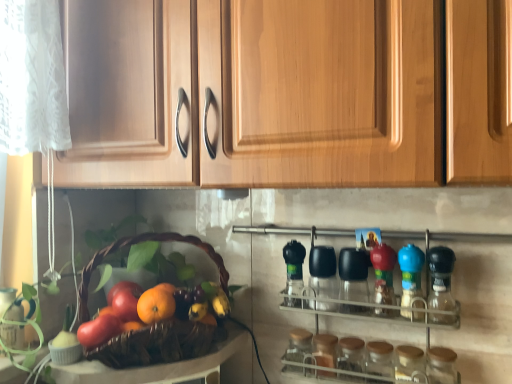
Identify the location of transparent plastic spice rack at center. (443, 239).

The width and height of the screenshot is (512, 384). Describe the element at coordinates (443, 239) in the screenshot. I see `transparent plastic spice rack at center` at that location.

You are a GUI agent. You are given a task and a screenshot of the screen. Output one action in this format:
    pyautogui.click(x=<x>, y=<y>)
    Task: Click on the brown woven basket at lower left
    This screenshot has height=384, width=512.
    Given the screenshot: What is the action you would take?
    click(155, 345)

What is the approximate width of orange matte at center?

orange matte at center is 2.50 inches wide.

What is the approximate height of orange matte at center?

The height of orange matte at center is 5.90 centimeters.

You are a GUI agent. You are given a task and a screenshot of the screen. Output one action in this format:
    pyautogui.click(x=<x>, y=<y>)
    Task: Click on the matte red apple at lower left, placed as the 1th apple when sorted from front to back
    Image resolution: width=512 pixels, height=384 pixels.
    Given the screenshot: What is the action you would take?
    pyautogui.click(x=99, y=330)

The image size is (512, 384). Describe the element at coordinates (294, 266) in the screenshot. I see `green matte bottle at center, marked as the fourth bottle in a right-to-left arrangement` at that location.

Locate an element on the screen. This screenshot has width=512, height=384. transparent plastic spice rack at center is located at coordinates (443, 239).

Would you consider transparent glass jar at lower right, which is the 1th bottle from right to left, to be distant from transparent plastic spice rack at center?

That's not correct — transparent glass jar at lower right, which is the 1th bottle from right to left, is a little close to transparent plastic spice rack at center.

Is transparent glass jar at lower right, which is the 1th bottle from right to left, turned away from transparent plastic spice rack at center?

Yes, transparent glass jar at lower right, which is the 1th bottle from right to left, is facing away from transparent plastic spice rack at center.

Consider the image. Which is more to the right, transparent glass jar at lower right, which is the fourth bottle in left-to-right order, or transparent plastic spice rack at center?

From the viewer's perspective, transparent glass jar at lower right, which is the fourth bottle in left-to-right order, appears more on the right side.

Looking at the image, does transparent glass jar at lower right, which is the fourth bottle in left-to-right order, seem bigger or smaller compared to transparent plastic spice rack at center?

Considering their sizes, transparent glass jar at lower right, which is the fourth bottle in left-to-right order, takes up less space than transparent plastic spice rack at center.

Could you tell me if transparent glass jar at lower center, the second bottle positioned from the left, is turned towards orange matte at center?

No, transparent glass jar at lower center, the second bottle positioned from the left, is not facing towards orange matte at center.

Considering the relative sizes of transparent glass jar at lower center, positioned as the 3th bottle in right-to-left order, and orange matte at center in the image provided, is transparent glass jar at lower center, positioned as the 3th bottle in right-to-left order, shorter than orange matte at center?

In fact, transparent glass jar at lower center, positioned as the 3th bottle in right-to-left order, may be taller than orange matte at center.

From a real-world perspective, is transparent glass jar at lower center, positioned as the 3th bottle in right-to-left order, positioned under orange matte at center based on gravity?

Yes.

Consider the image. Who is smaller, transparent glass jar at lower center, the second bottle positioned from the left, or orange matte at center?

With smaller size is orange matte at center.

Considering the relative sizes of brown woven basket at lower left and transparent plastic spice rack at center in the image provided, is brown woven basket at lower left smaller than transparent plastic spice rack at center?

Actually, brown woven basket at lower left might be larger than transparent plastic spice rack at center.

From the image's perspective, is brown woven basket at lower left above transparent plastic spice rack at center?

Yes, from the image's perspective, brown woven basket at lower left is on top of transparent plastic spice rack at center.

Which is more to the left, brown woven basket at lower left or transparent plastic spice rack at center?

brown woven basket at lower left is more to the left.

In the scene shown: Between brown woven basket at lower left and transparent plastic spice rack at center, which one has smaller width?

transparent plastic spice rack at center is thinner.

Can you confirm if transparent glass jar at lower center, the second bottle positioned from the left, is taller than shiny purple grapes at center?

Indeed, transparent glass jar at lower center, the second bottle positioned from the left, has a greater height compared to shiny purple grapes at center.

Which is less distant, (341,360) or (177,296)?

Point (341,360) appears to be closer to the viewer than point (177,296).

Is transparent glass jar at lower center, positioned as the 3th bottle in right-to-left order, completely or partially outside of shiny purple grapes at center?

Yes.

Based on their positions, is transparent glass jar at lower center, positioned as the 3th bottle in right-to-left order, located to the left or right of shiny purple grapes at center?

Based on their positions, transparent glass jar at lower center, positioned as the 3th bottle in right-to-left order, is located to the right of shiny purple grapes at center.

Locate an element on the screen. orange above the matte red apple at lower left, the 2th apple positioned from the back (from the image's perspective) is located at coordinates (155, 305).

In the scene shown: Who is shorter, matte red apple at lower left, the 2th apple positioned from the back, or orange matte at center?

With less height is orange matte at center.

Is matte red apple at lower left, placed as the 1th apple when sorted from front to back, inside the boundaries of orange matte at center, or outside?

matte red apple at lower left, placed as the 1th apple when sorted from front to back, is not enclosed by orange matte at center.

In the scene shown: From a real-world perspective, which is physically below, matte red apple at lower left, the 2th apple positioned from the back, or orange matte at center?

In real-world perspective, matte red apple at lower left, the 2th apple positioned from the back, is lower.

Considering the points (399, 252) and (185, 304), which point is behind, point (399, 252) or point (185, 304)?

The point (185, 304) is more distant.

From the image's perspective, is blue plastic bottle at right, the second bottle viewed from the right, beneath shiny purple grapes at center?

Incorrect, from the image's perspective, blue plastic bottle at right, the second bottle viewed from the right, is higher than shiny purple grapes at center.

Is blue plastic bottle at right, placed as the 3th bottle when sorted from left to right, bigger than shiny purple grapes at center?

Yes, blue plastic bottle at right, placed as the 3th bottle when sorted from left to right, is bigger than shiny purple grapes at center.

Are blue plastic bottle at right, the second bottle viewed from the right, and shiny purple grapes at center far apart?

No, blue plastic bottle at right, the second bottle viewed from the right, is in close proximity to shiny purple grapes at center.

Is the position of green matte bottle at center, marked as the fourth bottle in a right-to-left arrangement, more distant than that of transparent glass jar at lower right, which is the fourth bottle in left-to-right order?

Yes, the depth of green matte bottle at center, marked as the fourth bottle in a right-to-left arrangement, is greater than that of transparent glass jar at lower right, which is the fourth bottle in left-to-right order.

Could you measure the distance between green matte bottle at center, marked as the fourth bottle in a right-to-left arrangement, and transparent glass jar at lower right, which is the fourth bottle in left-to-right order?

11.67 inches.

This screenshot has width=512, height=384. I want to click on the 3rd bottle to the right of the green matte bottle at center, marked as the fourth bottle in a right-to-left arrangement, starting your count from the anchor, so click(441, 365).

Looking at this image, is green matte bottle at center, marked as the fourth bottle in a right-to-left arrangement, spatially inside transparent glass jar at lower right, which is the 1th bottle from right to left, or outside of it?

green matte bottle at center, marked as the fourth bottle in a right-to-left arrangement, is not inside transparent glass jar at lower right, which is the 1th bottle from right to left, it's outside.

Which bottle is the 2nd one when counting from the back of the transparent plastic spice rack at center? Please provide its 2D coordinates.

[(441, 365)]

You are a GUI agent. You are given a task and a screenshot of the screen. Output one action in this format:
    pyautogui.click(x=<x>, y=<y>)
    Task: Click on the orange positioned vertically above the transparent glass jar at lower center, the second bottle positioned from the left (from a real-world perspective)
    The image size is (512, 384).
    Given the screenshot: What is the action you would take?
    pyautogui.click(x=155, y=305)

Looking at this image, based on their spatial positions, is shiny purple grapes at center or transparent glass jar at lower right, which is the 1th bottle from right to left, further from matte red apple at lower left, which appears as the second apple when viewed from the front?

The object further to matte red apple at lower left, which appears as the second apple when viewed from the front, is transparent glass jar at lower right, which is the 1th bottle from right to left.

Based on their spatial positions, is transparent glass jar at lower center, positioned as the 3th bottle in right-to-left order, or transparent glass jar at lower right, which is the 1th bottle from right to left, closer to blue plastic bottle at right, the second bottle viewed from the right?

Among the two, transparent glass jar at lower right, which is the 1th bottle from right to left, is located nearer to blue plastic bottle at right, the second bottle viewed from the right.

When comparing their distances from orange matte at center, does transparent glass jar at lower center, the second bottle positioned from the left, or transparent glass jar at lower right, which is the 1th bottle from right to left, seem closer?

transparent glass jar at lower center, the second bottle positioned from the left, is closer to orange matte at center.

Considering their positions, is brown woven basket at lower left positioned closer to shiny purple grapes at center than blue plastic bottle at right, placed as the 3th bottle when sorted from left to right?

brown woven basket at lower left is positioned closer to the anchor shiny purple grapes at center.

Considering their positions, is transparent glass jar at lower center, positioned as the 3th bottle in right-to-left order, positioned further to green matte bottle at center, marked as the fourth bottle in a right-to-left arrangement, than blue plastic bottle at right, the second bottle viewed from the right?

Among the two, blue plastic bottle at right, the second bottle viewed from the right, is located further to green matte bottle at center, marked as the fourth bottle in a right-to-left arrangement.

Considering their positions, is transparent plastic spice rack at center positioned closer to brown woven basket at lower left than matte red apple at lower left, placed as the first apple when sorted from back to front?

matte red apple at lower left, placed as the first apple when sorted from back to front, is closer to brown woven basket at lower left.

Looking at this image, looking at the image, which one is located further to transparent glass jar at lower center, the second bottle positioned from the left, blue plastic bottle at right, the second bottle viewed from the right, or matte red apple at lower left, placed as the first apple when sorted from back to front?

matte red apple at lower left, placed as the first apple when sorted from back to front, is further to transparent glass jar at lower center, the second bottle positioned from the left.

Estimate the real-world distances between objects in this image. Which object is closer to transparent glass jar at lower center, positioned as the 3th bottle in right-to-left order, brown woven basket at lower left or matte red apple at lower left, placed as the 1th apple when sorted from front to back?

brown woven basket at lower left is closer to transparent glass jar at lower center, positioned as the 3th bottle in right-to-left order.

Identify the location of fruit situated between matte red apple at lower left, which appears as the second apple when viewed from the front, and blue plastic bottle at right, the second bottle viewed from the right, from left to right. The image size is (512, 384). (200, 302).

Locate an element on the screen. The height and width of the screenshot is (384, 512). orange located between matte red apple at lower left, which appears as the second apple when viewed from the front, and transparent glass jar at lower right, which is the fourth bottle in left-to-right order, in the left-right direction is located at coordinates (155, 305).

Find the location of a particular element. The width and height of the screenshot is (512, 384). basket between matte red apple at lower left, placed as the first apple when sorted from back to front, and transparent plastic spice rack at center, in the horizontal direction is located at coordinates pyautogui.click(x=155, y=345).

Locate an element on the screen. Image resolution: width=512 pixels, height=384 pixels. apple situated between matte red apple at lower left, placed as the 1th apple when sorted from front to back, and transparent glass jar at lower right, which is the fourth bottle in left-to-right order, from left to right is located at coordinates (126, 302).